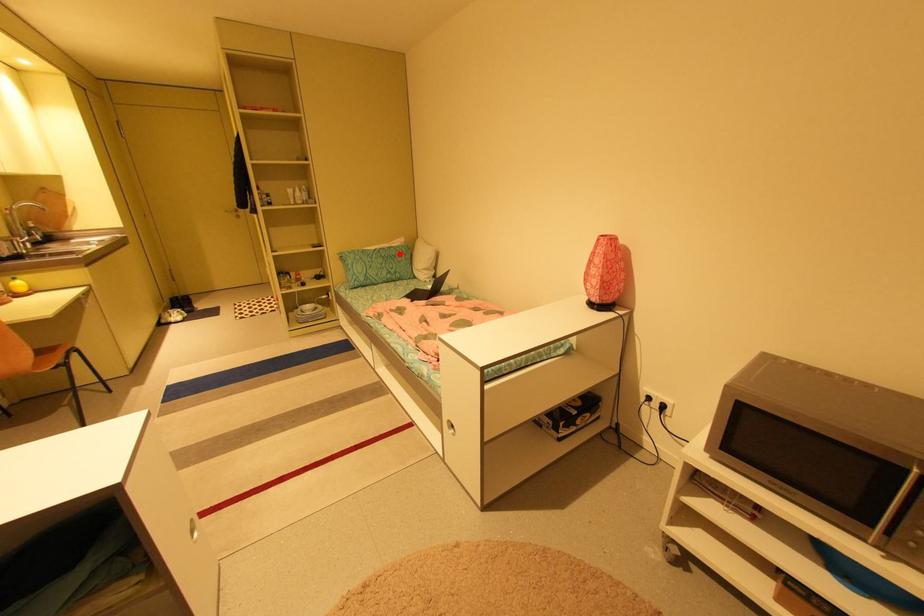
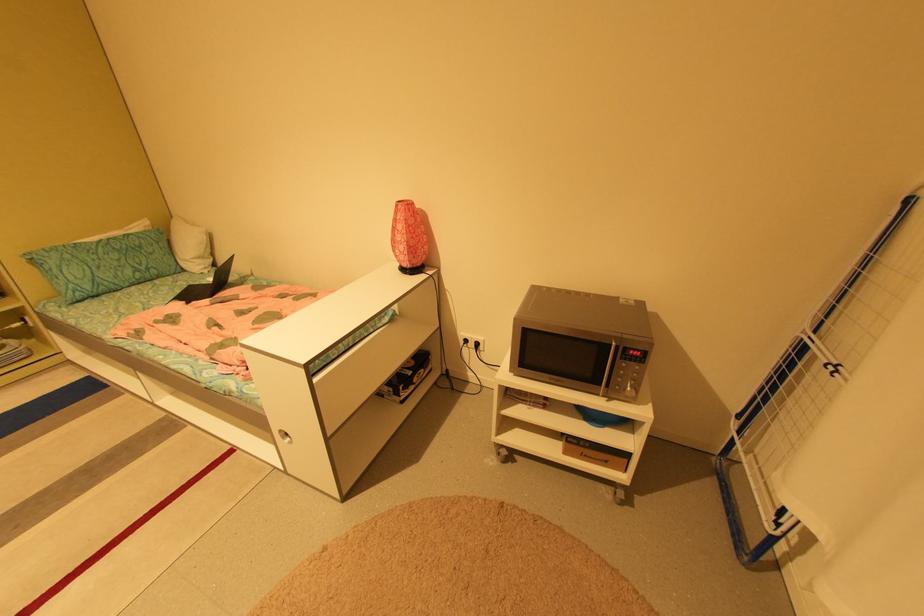
Where in the second image is the point corresponding to the highlighted location from the first image?

(142, 244)